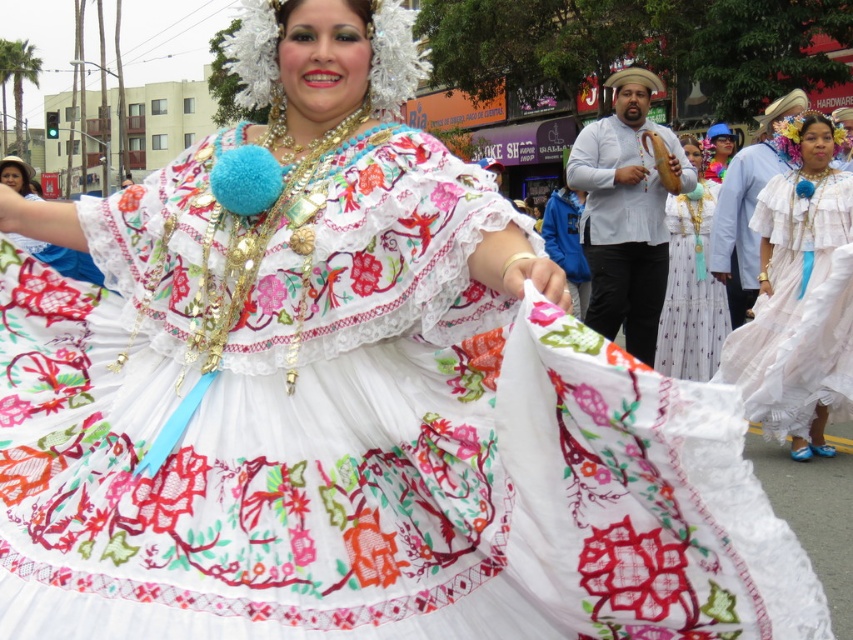
Question: Observing the image, what is the correct spatial positioning of white embroidered dress at center in reference to matte blue hat at upper center?

Choices:
 (A) right
 (B) left

Answer: (B)

Question: Where is white lace dress at center located in relation to white embroidered dress at center in the image?

Choices:
 (A) above
 (B) below

Answer: (A)

Question: Considering the real-world distances, which object is farthest from the white lace dress at center?

Choices:
 (A) matte blue hat at upper center
 (B) white cotton dress at center
 (C) white embroidered dress at center

Answer: (C)

Question: Is white lace dress at center positioned before matte blue hat at upper center?

Choices:
 (A) yes
 (B) no

Answer: (A)

Question: Which object is positioned closest to the matte blue hat at upper center?

Choices:
 (A) white embroidered dress at center
 (B) white cotton dress at center
 (C) white lace dress at center

Answer: (C)

Question: Which is farther from the white embroidered dress at center?

Choices:
 (A) white cotton dress at center
 (B) white lace dress at center

Answer: (B)